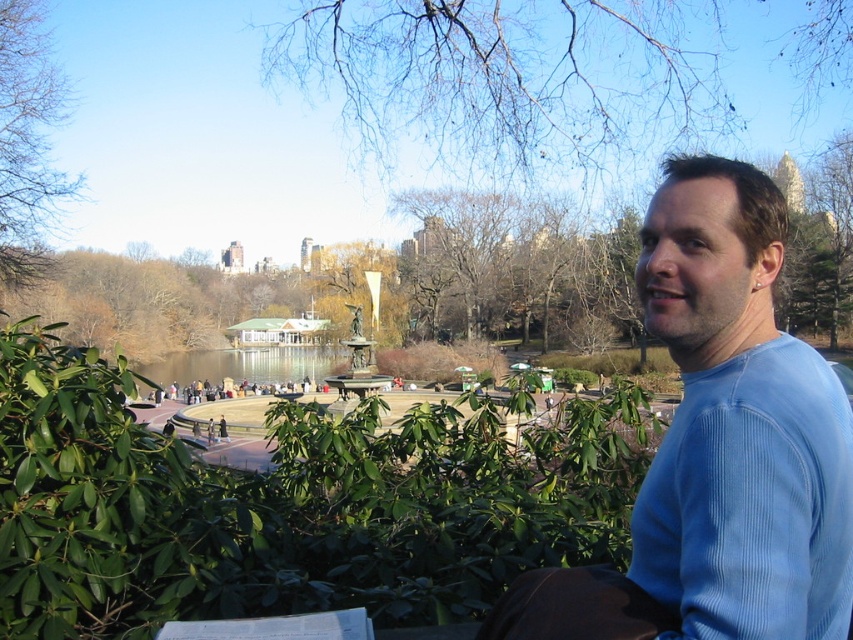
Measure the distance between blue ribbed sweater at right and clear water at center.

blue ribbed sweater at right and clear water at center are 65.15 meters apart from each other.

Does blue ribbed sweater at right have a larger size compared to clear water at center?

Actually, blue ribbed sweater at right might be smaller than clear water at center.

Who is more distant from viewer, [770,470] or [141,365]?

The point [141,365] is behind.

You are a GUI agent. You are given a task and a screenshot of the screen. Output one action in this format:
    pyautogui.click(x=<x>, y=<y>)
    Task: Click on the blue ribbed sweater at right
    The image size is (853, 640).
    Given the screenshot: What is the action you would take?
    pyautogui.click(x=718, y=445)

Based on the photo, how far apart are bare branches at upper center and bare branches at upper left?

A distance of 23.70 meters exists between bare branches at upper center and bare branches at upper left.

Looking at this image, is bare branches at upper center smaller than bare branches at upper left?

Incorrect, bare branches at upper center is not smaller in size than bare branches at upper left.

You are a GUI agent. You are given a task and a screenshot of the screen. Output one action in this format:
    pyautogui.click(x=<x>, y=<y>)
    Task: Click on the bare branches at upper center
    This screenshot has width=853, height=640.
    Given the screenshot: What is the action you would take?
    pyautogui.click(x=512, y=77)

Which is more to the left, bare branches at upper center or clear water at center?

clear water at center

Does point (387, 74) come farther from viewer compared to point (257, 353)?

That is False.

Is point (695, 72) more distant than point (299, 358)?

No, (695, 72) is in front of (299, 358).

Find the location of a particular element. bare branches at upper center is located at coordinates (512, 77).